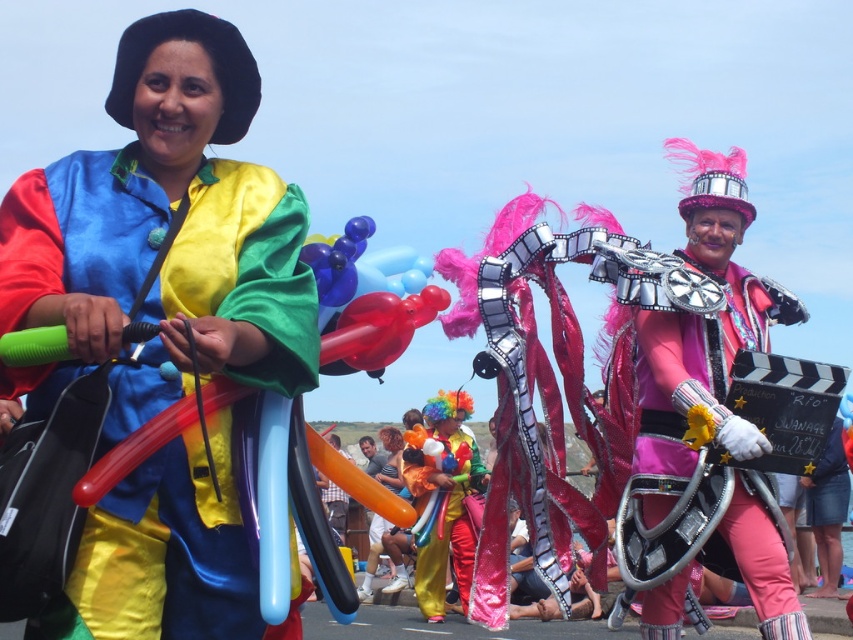
Question: Does pink satin film strip at center have a larger size compared to shiny metallic clown at center?

Choices:
 (A) no
 (B) yes

Answer: (B)

Question: Is pink satin film strip at center smaller than shiny metallic clown at center?

Choices:
 (A) yes
 (B) no

Answer: (B)

Question: Considering the relative positions of shiny satin balloon at center and translucent red balloon at center in the image provided, where is shiny satin balloon at center located with respect to translucent red balloon at center?

Choices:
 (A) right
 (B) left

Answer: (B)

Question: Estimate the real-world distances between objects in this image. Which object is closer to the pink satin film strip at center?

Choices:
 (A) shiny satin balloon at center
 (B) translucent red balloon at center

Answer: (B)

Question: Among these points, which one is farthest from the camera?

Choices:
 (A) (357, 227)
 (B) (430, 557)
 (C) (712, 564)

Answer: (B)

Question: Which point appears farthest from the camera in this image?

Choices:
 (A) (444, 566)
 (B) (665, 572)

Answer: (A)